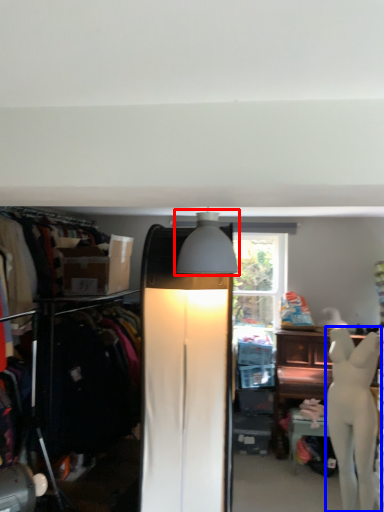
Question: Which object appears farthest to the camera in this image, lamp (highlighted by a red box) or mannequin (highlighted by a blue box)?

Choices:
 (A) lamp
 (B) mannequin

Answer: (B)